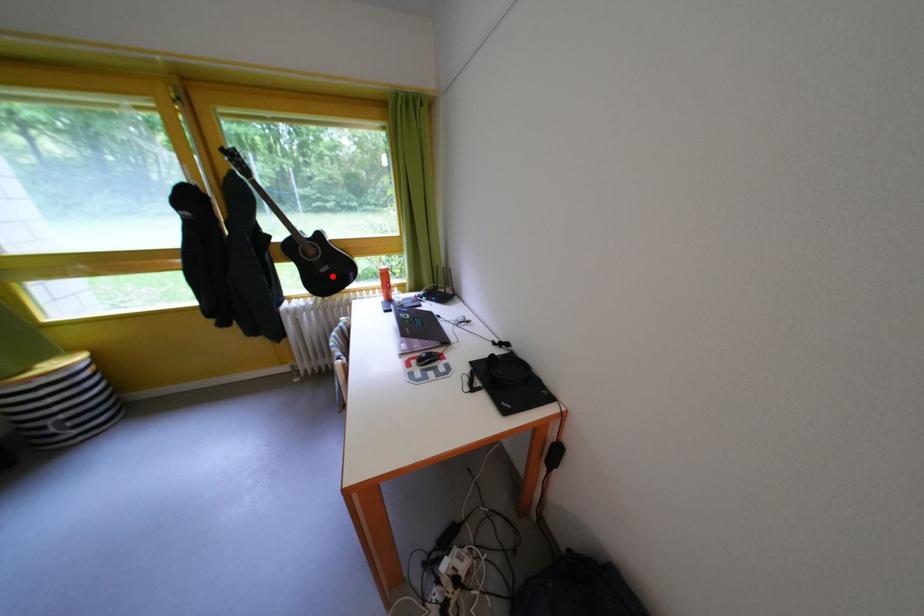
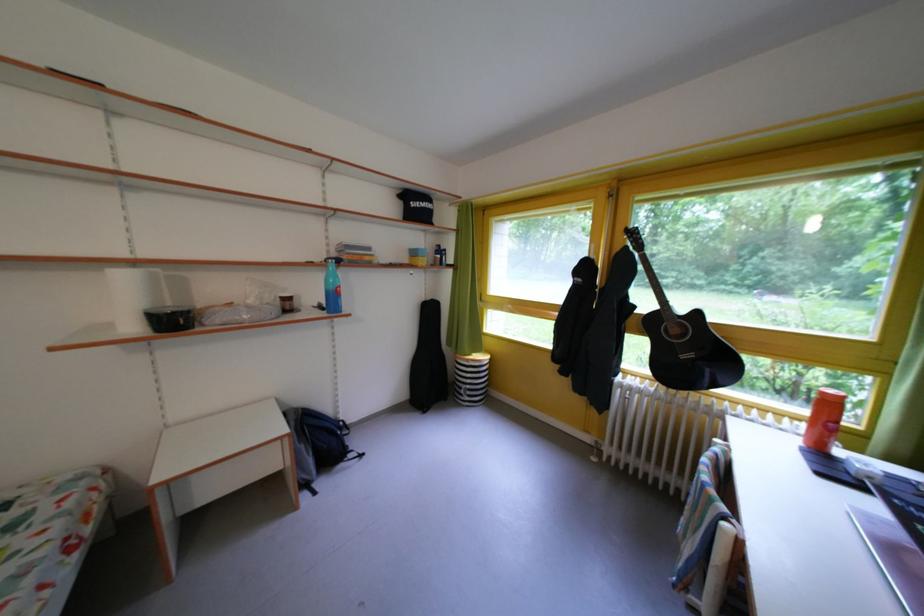
Question: A red point is marked in image1. In image2, is the corresponding 3D point closer to the camera or farther? Reply with the corresponding letter.

Choices:
 (A) The corresponding 3D point is closer.
 (B) The corresponding 3D point is farther.

Answer: (B)